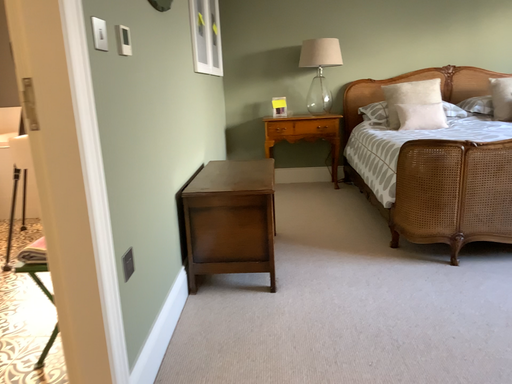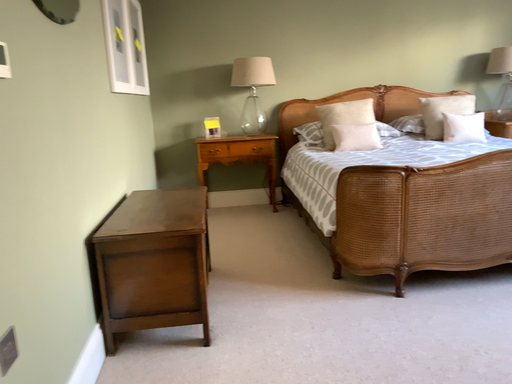
Question: Which way did the camera rotate in the video?

Choices:
 (A) rotated right
 (B) rotated left

Answer: (A)